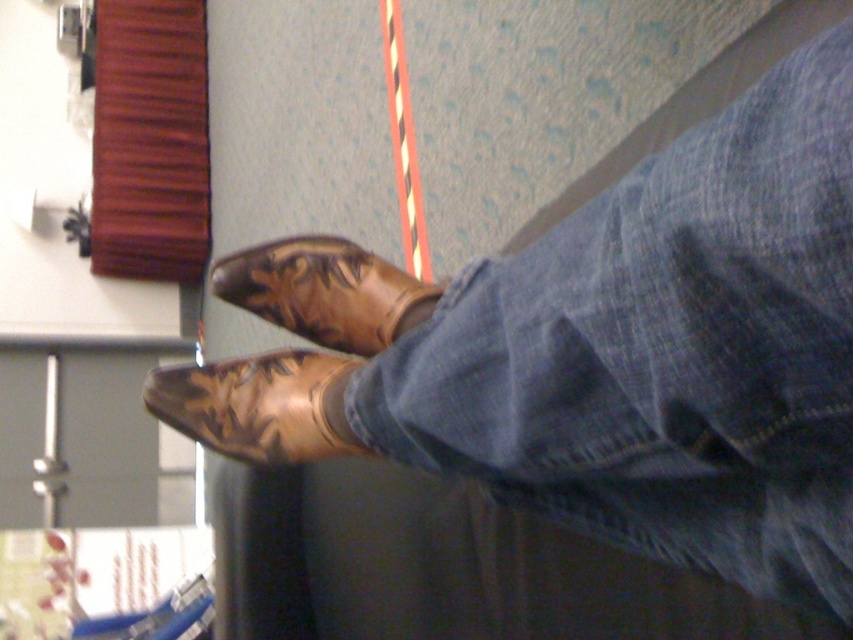
Question: Based on their relative distances, which object is farther from the shiny brown leather boot at lower center?

Choices:
 (A) denim at lower right
 (B) brown leather boot at center

Answer: (A)

Question: Can you confirm if denim at lower right is wider than brown leather boot at center?

Choices:
 (A) yes
 (B) no

Answer: (A)

Question: In this image, where is denim at lower right located relative to brown leather boot at center?

Choices:
 (A) left
 (B) right

Answer: (B)

Question: Which is nearer to the denim at lower right?

Choices:
 (A) brown leather boot at center
 (B) shiny brown leather boot at lower center

Answer: (B)

Question: Where is denim at lower right located in relation to brown leather boot at center in the image?

Choices:
 (A) above
 (B) below

Answer: (B)

Question: Which object appears closest to the camera in this image?

Choices:
 (A) denim at lower right
 (B) shiny brown leather boot at lower center

Answer: (A)